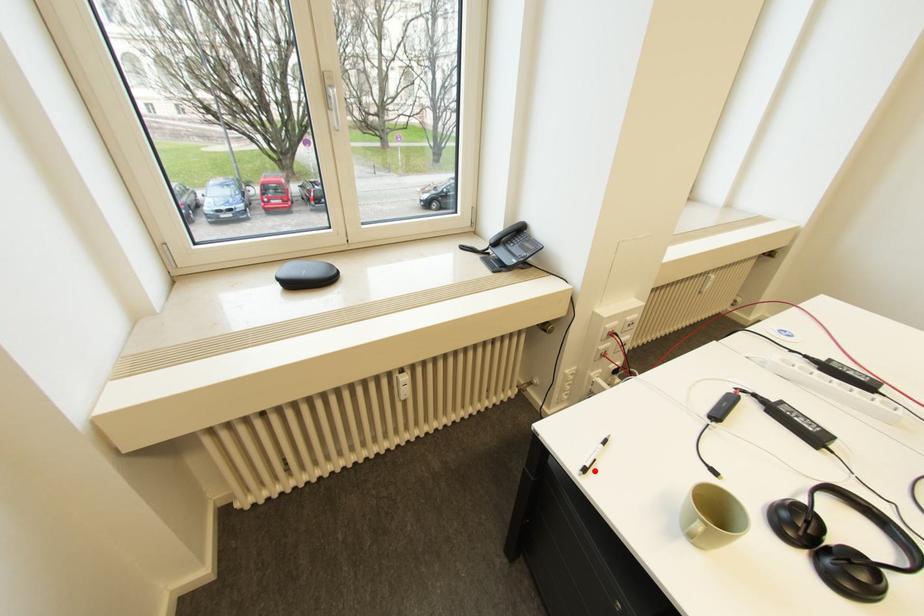
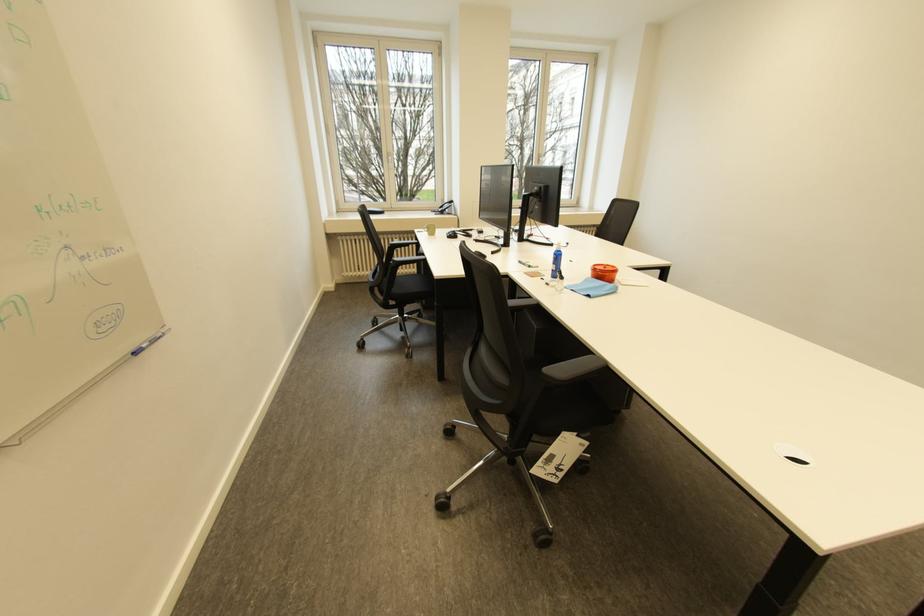
In the second image, find the point that corresponds to the highlighted location in the first image.

(428, 233)